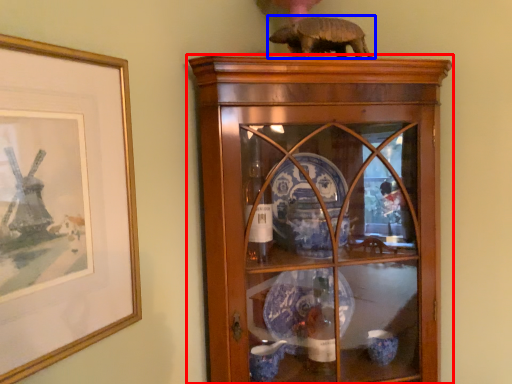
Question: Which of the following is the closest to the observer, shelf (highlighted by a red box) or animal (highlighted by a blue box)?

Choices:
 (A) shelf
 (B) animal

Answer: (A)